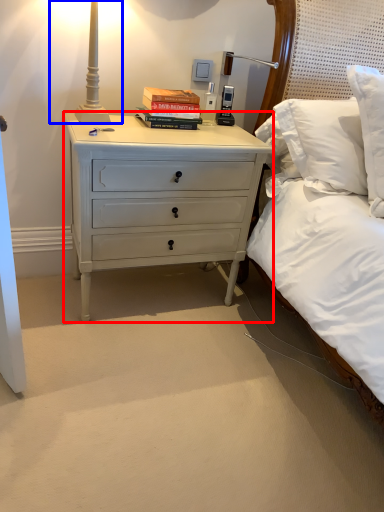
Question: Which point is closer to the camera, nightstand (highlighted by a red box) or bedside lamp (highlighted by a blue box)?

Choices:
 (A) nightstand
 (B) bedside lamp

Answer: (B)